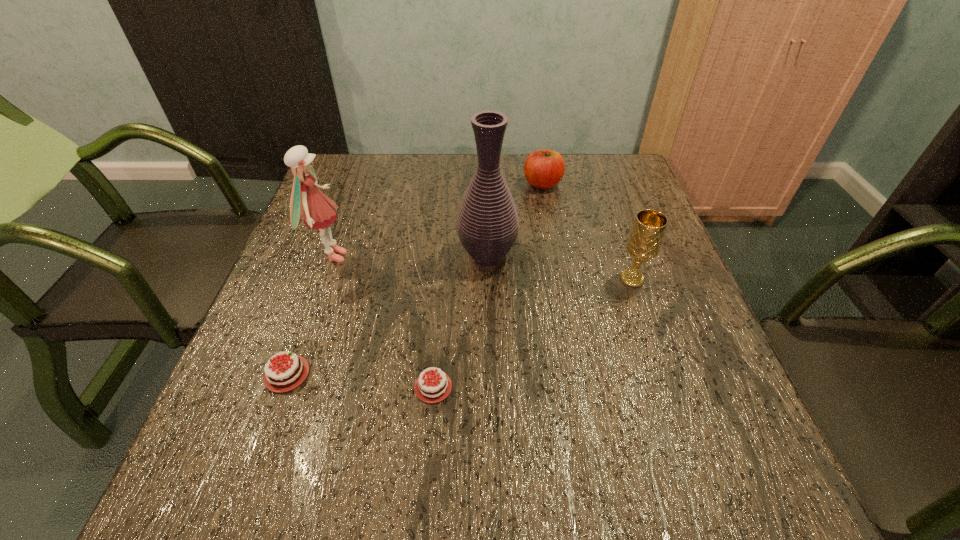
At what (x,y) coordinates should I click in order to perform the action: click on object that is at the near left corner. Please return your answer as a coordinate pair (x, y). The height and width of the screenshot is (540, 960). Looking at the image, I should click on (282, 376).

Find the location of a particular element. This screenshot has width=960, height=540. vacant space at the far edge is located at coordinates (386, 186).

The width and height of the screenshot is (960, 540). Identify the location of vacant space at the left edge. (250, 350).

Where is `free space at the right edge of the desktop`? This screenshot has height=540, width=960. free space at the right edge of the desktop is located at coordinates (674, 291).

The image size is (960, 540). Find the location of `vacant space at the far right corner`. vacant space at the far right corner is located at coordinates (588, 177).

You are a GUI agent. You are given a task and a screenshot of the screen. Output one action in this format:
    pyautogui.click(x=<x>, y=<y>)
    Task: Click on the vacant space at the near right corner of the desktop
    
    Given the screenshot: What is the action you would take?
    pyautogui.click(x=686, y=428)

Identify the location of vacant space in between the second object from right to left and the second tallest object. (437, 220).

I want to click on vacant space that's between the chalice and the right chocolate cake, so click(x=533, y=333).

At what (x,y) coordinates should I click in order to perform the action: click on unoccupied position between the taller chocolate cake and the chalice. Please return your answer as a coordinate pair (x, y). The image size is (960, 540). Looking at the image, I should click on (460, 326).

Image resolution: width=960 pixels, height=540 pixels. In order to click on free area in between the tallest object and the fourth shortest object in this screenshot , I will do `click(560, 267)`.